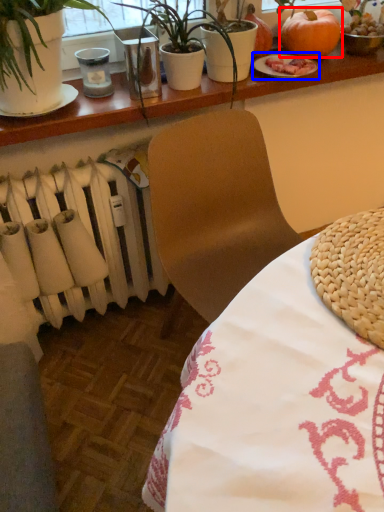
Question: Which object appears farthest to the camera in this image, pumpkin (highlighted by a red box) or tableware (highlighted by a blue box)?

Choices:
 (A) pumpkin
 (B) tableware

Answer: (A)